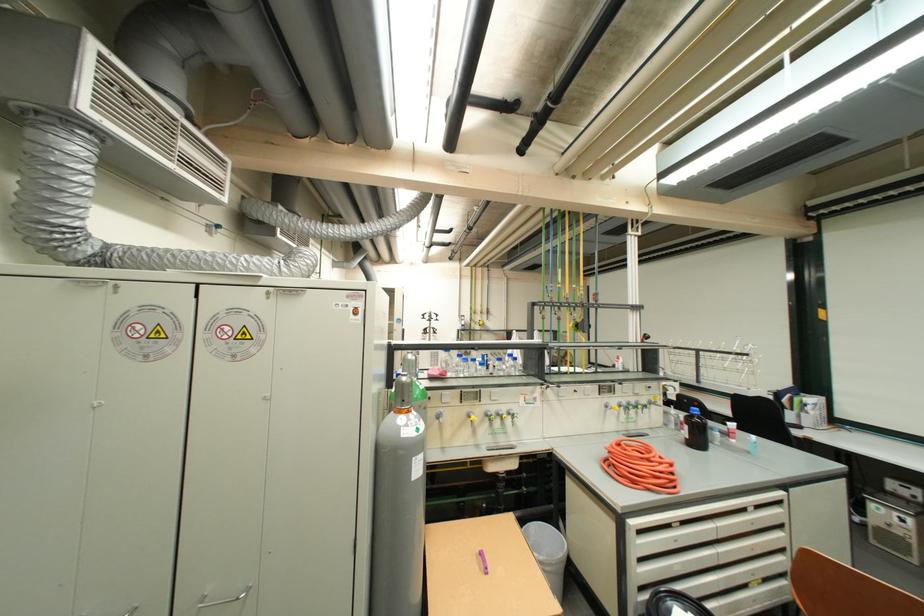
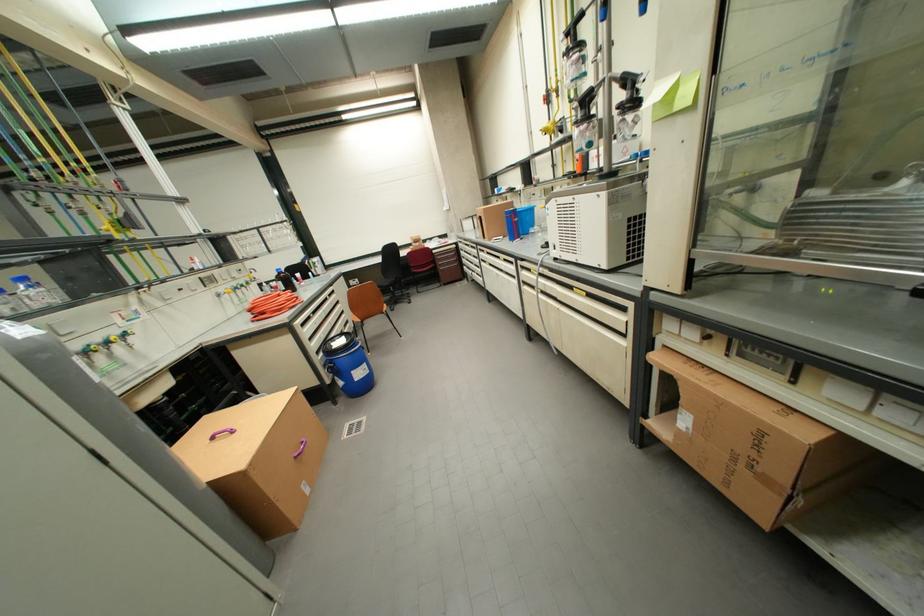
How did the camera likely rotate?

The camera rotated toward right-down.